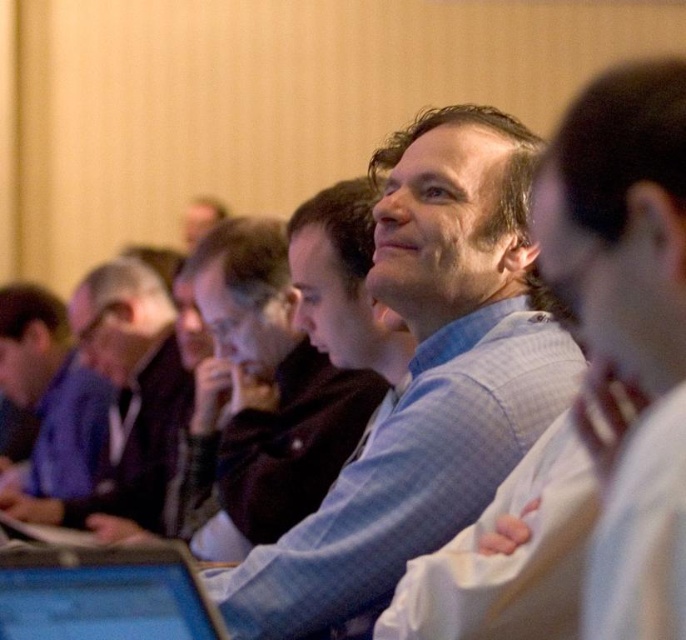
In the scene shown: You are an attendee at this conference. You need to locate the blue glossy laptop at center. Since you are looking at the blue checkered shirt at center, which direction should you look to find the laptop?

The blue checkered shirt at center is much taller than the blue glossy laptop at center, so the laptop is located below the shirt.

You are attending a meeting and notice two men in blue shirts. One is wearing a blue plaid shirt at center and the other a matte blue shirt at left. Based on their positions, which man is sitting closer to the front of the room?

The blue plaid shirt at center is sitting closer to the front of the room because it has a lesser height compared to the matte blue shirt at left, indicating it is positioned lower in the frame and thus nearer to the viewer.